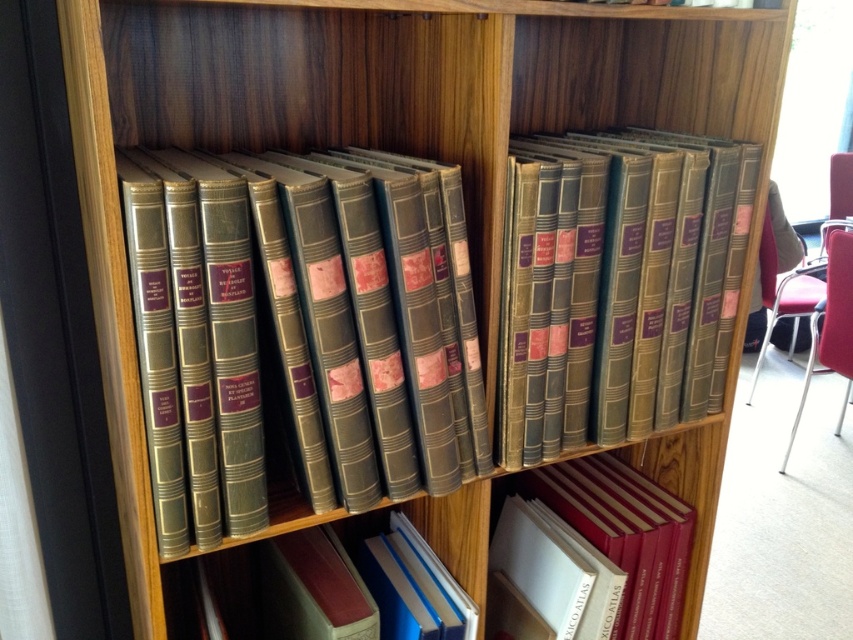
In the scene shown: Is matte leather book at center behind hardcover book at center?

No, matte leather book at center is in front of hardcover book at center.

Is matte leather book at center to the left of hardcover book at center from the viewer's perspective?

Incorrect, matte leather book at center is not on the left side of hardcover book at center.

Describe the element at coordinates (639, 276) in the screenshot. Image resolution: width=853 pixels, height=640 pixels. I see `matte leather book at center` at that location.

The height and width of the screenshot is (640, 853). In order to click on matte leather book at center in this screenshot , I will do `click(639, 276)`.

Which of these two, hardcover book at center or red leather book at lower right, stands taller?

red leather book at lower right is taller.

At what (x,y) coordinates should I click in order to perform the action: click on hardcover book at center. Please return your answer as a coordinate pair (x, y). The height and width of the screenshot is (640, 853). Looking at the image, I should click on (345, 588).

Can you confirm if matte leather book at center is positioned to the left of red leather book at lower right?

Indeed, matte leather book at center is positioned on the left side of red leather book at lower right.

Between point (685, 184) and point (596, 534), which one is positioned in front?

Point (685, 184) is more forward.

You are a GUI agent. You are given a task and a screenshot of the screen. Output one action in this format:
    pyautogui.click(x=<x>, y=<y>)
    Task: Click on the matte leather book at center
    The image size is (853, 640).
    Given the screenshot: What is the action you would take?
    pyautogui.click(x=639, y=276)